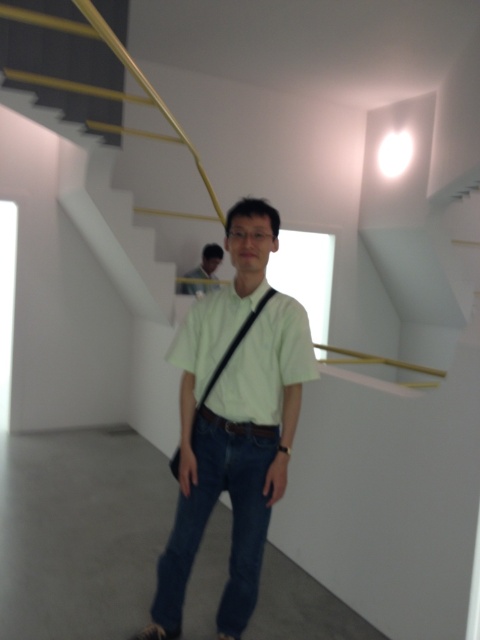
Between point (259, 298) and point (207, 392), which one is positioned behind?

Positioned behind is point (207, 392).

Does light green shirt at center appear on the left side of green fabric strap at center?

Indeed, light green shirt at center is positioned on the left side of green fabric strap at center.

Between point (226, 394) and point (202, 396), which one is positioned in front?

Point (226, 394) is more forward.

Where is `light green shirt at center`? light green shirt at center is located at coordinates tap(233, 419).

Is white matte stairs at upper center positioned behind matte black shirt at center?

That is False.

Is point (212, 189) more distant than point (194, 285)?

No, (212, 189) is in front of (194, 285).

Where is `white matte stairs at upper center`? white matte stairs at upper center is located at coordinates (117, 248).

From the picture: Does denim at center have a smaller size compared to green fabric strap at center?

Incorrect, denim at center is not smaller in size than green fabric strap at center.

Can you confirm if denim at center is thinner than green fabric strap at center?

In fact, denim at center might be wider than green fabric strap at center.

Measure the distance between denim at center and camera.

denim at center and camera are 6.42 feet apart from each other.

Where is `denim at center`? The image size is (480, 640). denim at center is located at coordinates (210, 513).